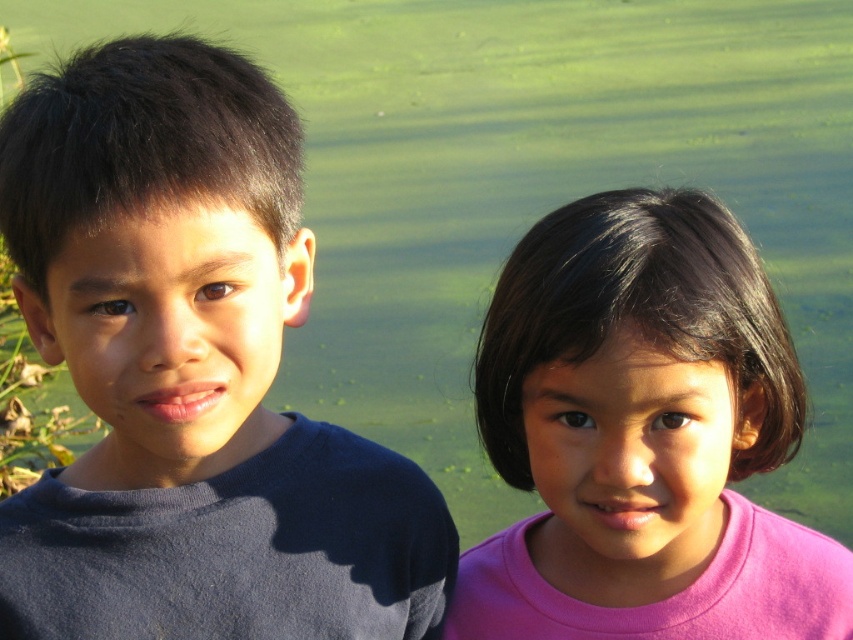
You are a photographer trying to adjust the focus of your camera to capture both children clearly. Since the dark blue shirt at left and the pink matte shirt at right are at different heights, which one is positioned higher in the frame?

The dark blue shirt at left is located above the pink matte shirt at right, so it is positioned higher in the frame.

You are a photographer who wants to capture a clear photo of both the dark blue shirt at left and the pink matte shirt at right. Given that your camera has a depth of field that can focus on objects within a 10 inch range, will both shirts be in focus?

The dark blue shirt at left is 11.58 inches away from the pink matte shirt at right, which exceeds the camera depth of field range of 10 inches. Therefore, both shirts cannot be in focus simultaneously.